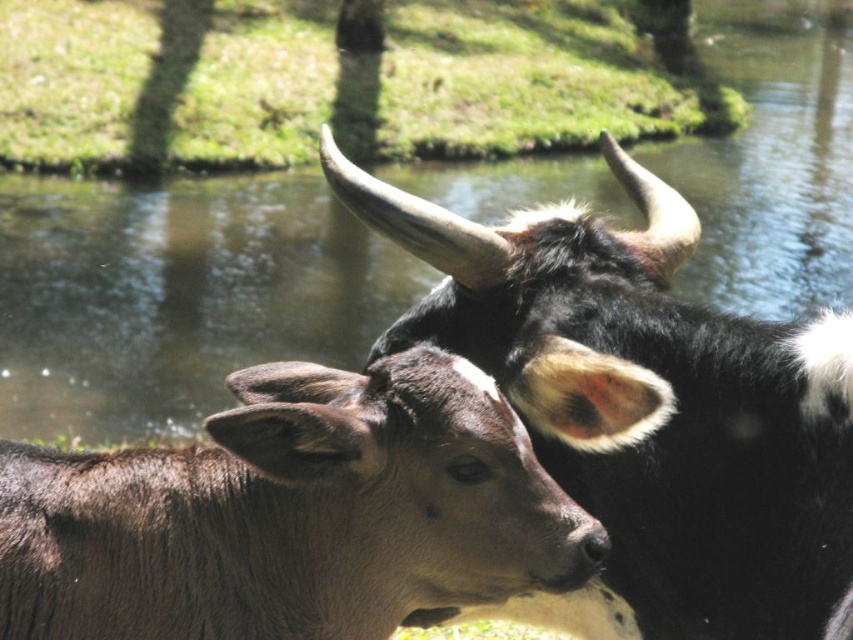
Is brown furry buffalo at center bigger than green grass at upper center?

Actually, brown furry buffalo at center might be smaller than green grass at upper center.

Between brown furry buffalo at center and green grass at upper center, which one has less height?

brown furry buffalo at center is shorter.

Who is more distant from viewer, [525,513] or [479,90]?

The point [479,90] is behind.

Locate an element on the screen. Image resolution: width=853 pixels, height=640 pixels. brown furry buffalo at center is located at coordinates (292, 513).

Between point (654, 205) and point (444, 136), which one is positioned in front?

Point (654, 205) is more forward.

Is black glossy horned buffalo at upper center shorter than green grass at upper center?

Correct, black glossy horned buffalo at upper center is not as tall as green grass at upper center.

You are a GUI agent. You are given a task and a screenshot of the screen. Output one action in this format:
    pyautogui.click(x=<x>, y=<y>)
    Task: Click on the black glossy horned buffalo at upper center
    
    Given the screenshot: What is the action you would take?
    pyautogui.click(x=645, y=410)

Locate an element on the screen. The height and width of the screenshot is (640, 853). black glossy horned buffalo at upper center is located at coordinates (645, 410).

Consider the image. Does black glossy horned buffalo at upper center appear on the right side of brown furry buffalo at center?

Correct, you'll find black glossy horned buffalo at upper center to the right of brown furry buffalo at center.

Is black glossy horned buffalo at upper center below brown furry buffalo at center?

No.

The width and height of the screenshot is (853, 640). What do you see at coordinates (645, 410) in the screenshot?
I see `black glossy horned buffalo at upper center` at bounding box center [645, 410].

What are the coordinates of `black glossy horned buffalo at upper center` in the screenshot? It's located at (645, 410).